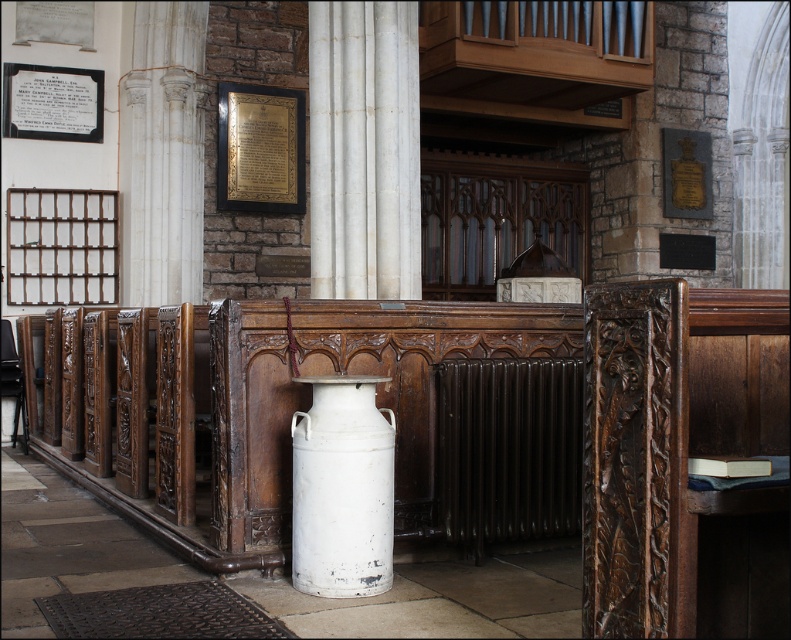
Where is `dark brown radiator at center`? Image resolution: width=791 pixels, height=640 pixels. dark brown radiator at center is located at coordinates (508, 449).

Between dark brown radiator at center and white matte milk canister at center, which one appears on the right side from the viewer's perspective?

dark brown radiator at center

Measure the distance between dark brown radiator at center and camera.

A distance of 5.20 meters exists between dark brown radiator at center and camera.

This screenshot has width=791, height=640. Find the location of `dark brown radiator at center`. dark brown radiator at center is located at coordinates (508, 449).